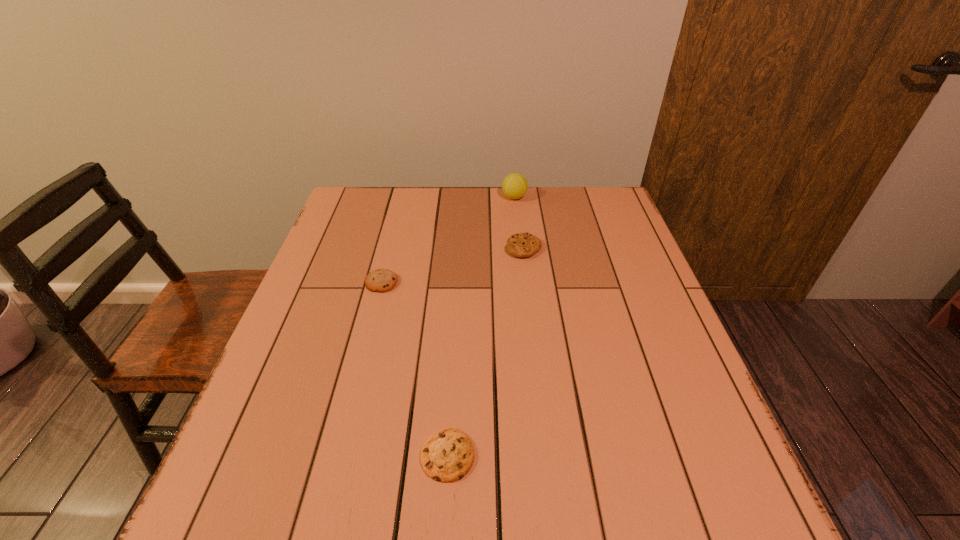
The image size is (960, 540). In the image, there is a desktop. In order to click on free space at the far right corner in this screenshot , I will do `click(589, 209)`.

Image resolution: width=960 pixels, height=540 pixels. Find the location of `free space at the near right corner of the desktop`. free space at the near right corner of the desktop is located at coordinates (714, 529).

Locate an element on the screen. free space between the tennis ball and the farthest cookie is located at coordinates (518, 222).

This screenshot has height=540, width=960. In order to click on free space between the shortest cookie and the second shortest object in this screenshot , I will do `click(415, 369)`.

Find the location of a particular element. Image resolution: width=960 pixels, height=540 pixels. empty location between the tallest object and the shortest cookie is located at coordinates (481, 326).

Image resolution: width=960 pixels, height=540 pixels. Find the location of `empty space that is in between the second shortest cookie and the tallest object`. empty space that is in between the second shortest cookie and the tallest object is located at coordinates point(448,240).

Identify the location of blank region between the second farthest cookie and the second cookie from left to right. (415, 369).

What are the coordinates of `vacant space that is in between the tallest cookie and the tallest object` in the screenshot? It's located at (518, 222).

Locate an element on the screen. vacant space in between the nearest object and the farthest object is located at coordinates (481, 326).

At what (x,y) coordinates should I click in order to perform the action: click on vacant point located between the nearest cookie and the farthest object. Please return your answer as a coordinate pair (x, y). Image resolution: width=960 pixels, height=540 pixels. Looking at the image, I should click on (481, 326).